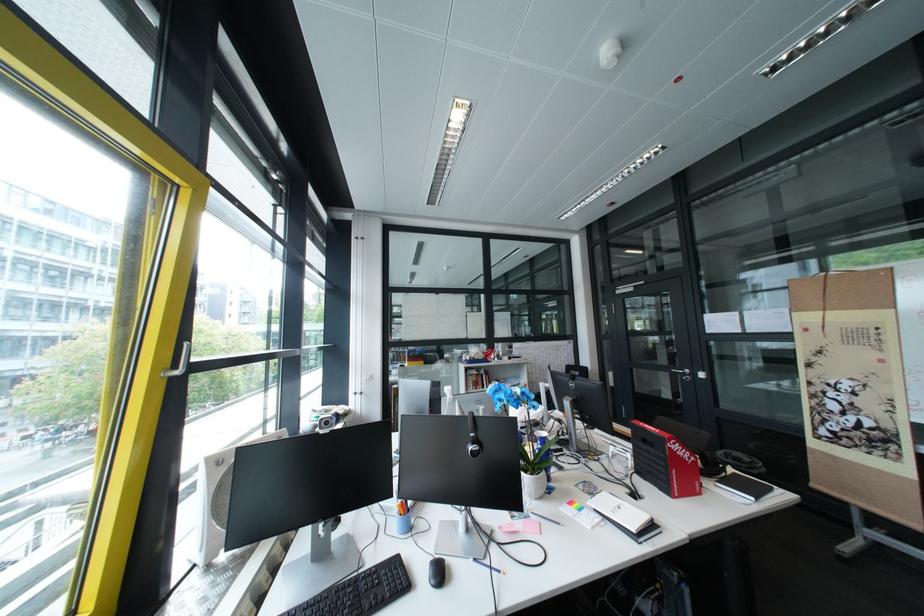
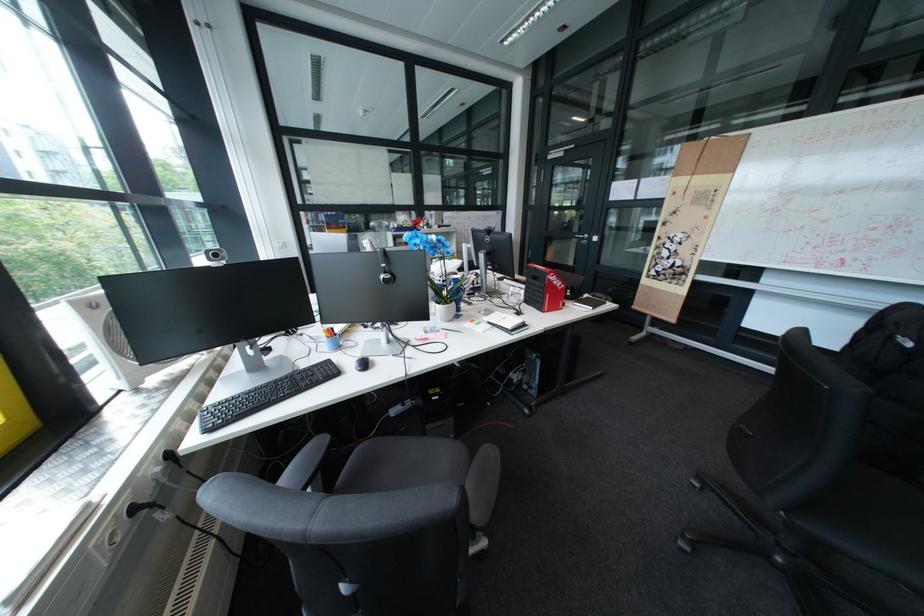
The point at (x=700, y=379) is marked in the first image. Where is the corresponding point in the second image?

(598, 243)